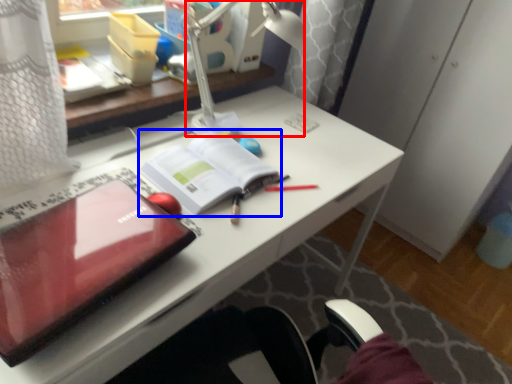
Question: Which of the following is the closest to the observer, lamp (highlighted by a red box) or paperback book (highlighted by a blue box)?

Choices:
 (A) lamp
 (B) paperback book

Answer: (A)